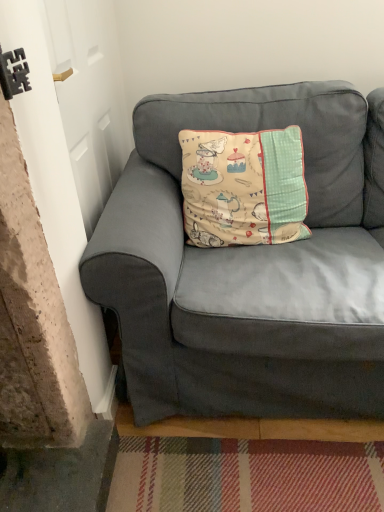
Question: Should I look upward or downward to see beige fabric cushion at center?

Choices:
 (A) up
 (B) down

Answer: (A)

Question: Is beige fabric cushion at center positioned with its back to matte gray couch at center?

Choices:
 (A) yes
 (B) no

Answer: (A)

Question: Can you confirm if beige fabric cushion at center is thinner than matte gray couch at center?

Choices:
 (A) yes
 (B) no

Answer: (A)

Question: Considering the relative sizes of beige fabric cushion at center and matte gray couch at center in the image provided, is beige fabric cushion at center wider than matte gray couch at center?

Choices:
 (A) yes
 (B) no

Answer: (B)

Question: Is the depth of beige fabric cushion at center less than that of matte gray couch at center?

Choices:
 (A) no
 (B) yes

Answer: (A)

Question: Can you confirm if beige fabric cushion at center is positioned to the right of matte gray couch at center?

Choices:
 (A) yes
 (B) no

Answer: (B)

Question: Is matte gray couch at center a part of beige fabric cushion at center?

Choices:
 (A) yes
 (B) no

Answer: (B)

Question: From a real-world perspective, is matte gray couch at center located higher than beige fabric cushion at center?

Choices:
 (A) no
 (B) yes

Answer: (A)

Question: Are matte gray couch at center and beige fabric cushion at center beside each other?

Choices:
 (A) yes
 (B) no

Answer: (B)

Question: Does matte gray couch at center have a smaller size compared to beige fabric cushion at center?

Choices:
 (A) no
 (B) yes

Answer: (A)

Question: Is matte gray couch at center shorter than beige fabric cushion at center?

Choices:
 (A) no
 (B) yes

Answer: (A)

Question: Is matte gray couch at center aimed at beige fabric cushion at center?

Choices:
 (A) yes
 (B) no

Answer: (A)

Question: Is matte gray couch at center closer to camera compared to beige fabric cushion at center?

Choices:
 (A) yes
 (B) no

Answer: (A)

Question: Looking at the image, does matte gray couch at center seem bigger or smaller compared to beige fabric cushion at center?

Choices:
 (A) big
 (B) small

Answer: (A)